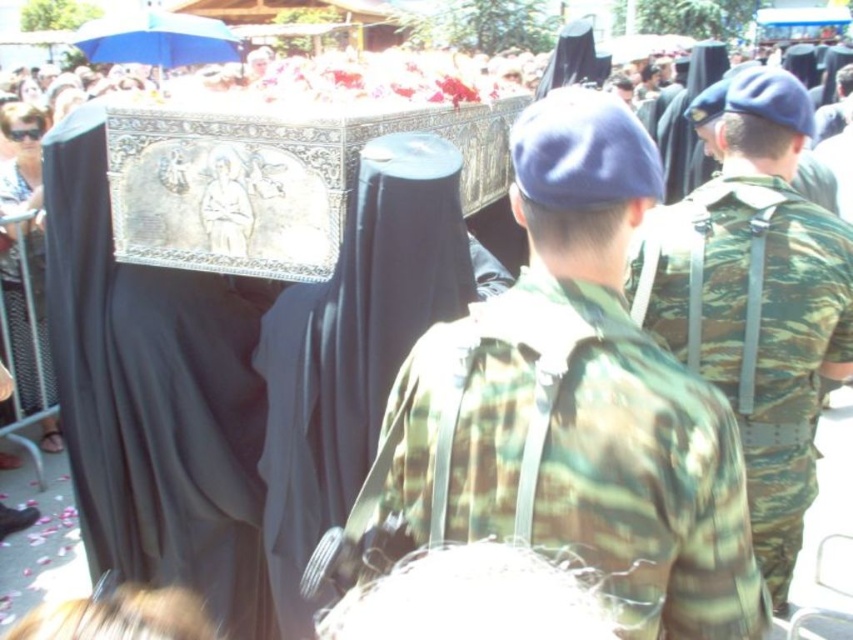
You are a photographer trying to capture the entire scene of the solemn procession. You notice a camouflage fabric backpack at center in the image. Based on its position, can you estimate whether it would be visible in a photo taken from directly above the procession?

The camouflage fabric backpack at center is located at point coordinates that are not indicative of height relative to the photographer. Without elevation data, it is impossible to determine visibility from above.

You are a photographer positioned at the front of the procession. You want to take a photo that includes both the camouflage fabric backpack at center and the camouflage fabric uniform at center. Which object should you adjust your camera to focus on first if you want to capture the one closer to the left side?

The camouflage fabric backpack at center is to the left of camouflage fabric uniform at center, so you should focus on the camouflage fabric backpack at center first as it is closer to the left side.